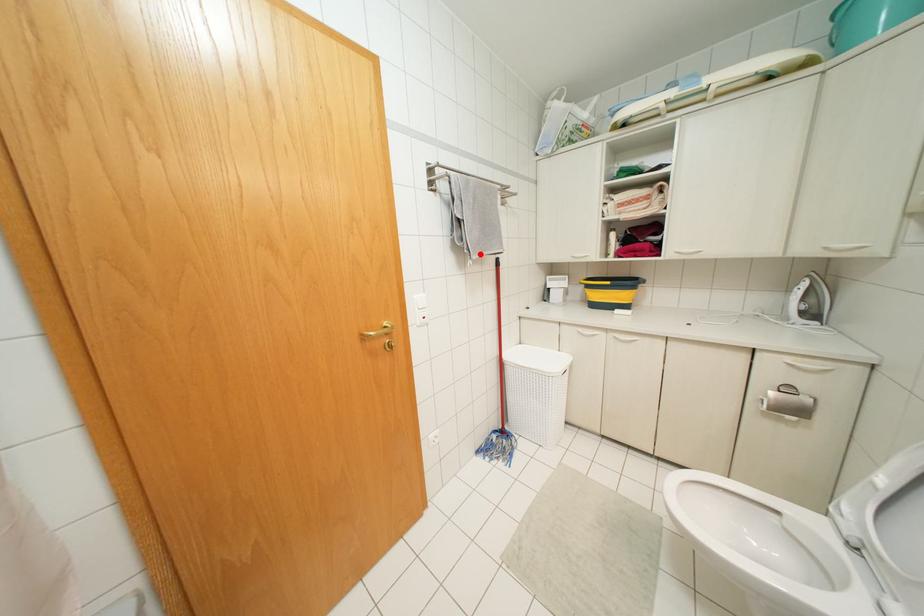
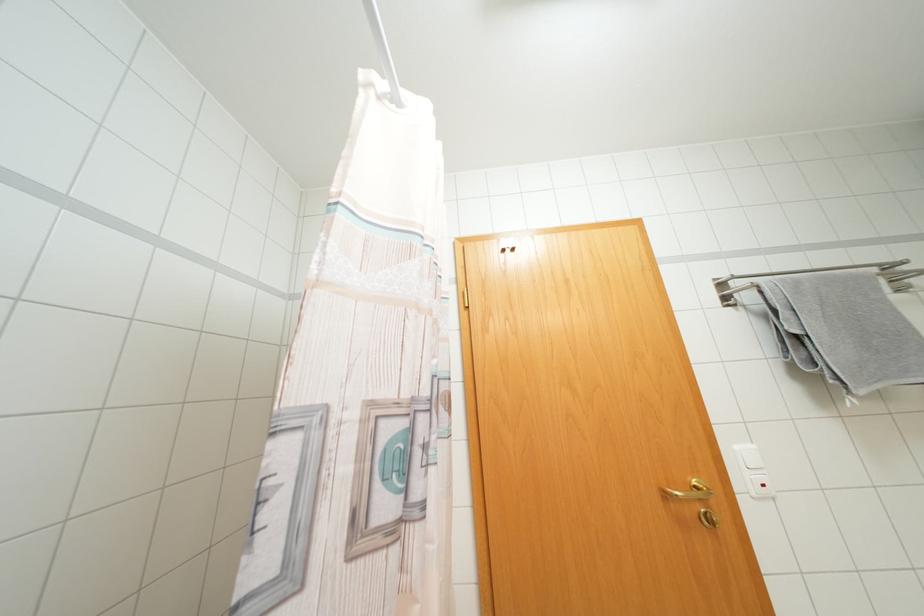
Question: I am providing you with two images of the same scene from different viewpoints. In image1, a red point is highlighted. Considering the same 3D point in image2, which of the following is correct?

Choices:
 (A) It is closer
 (B) It is farther

Answer: (A)